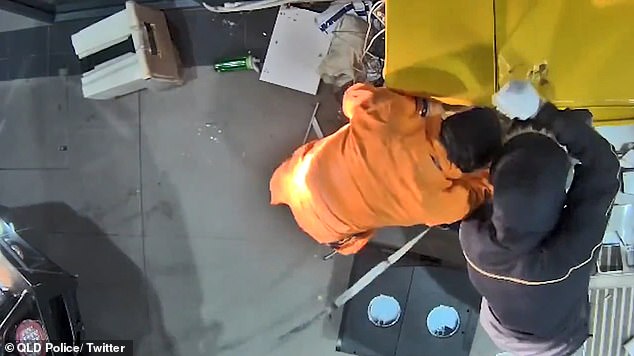
Where is `floor`? Image resolution: width=634 pixels, height=356 pixels. floor is located at coordinates (183, 216).